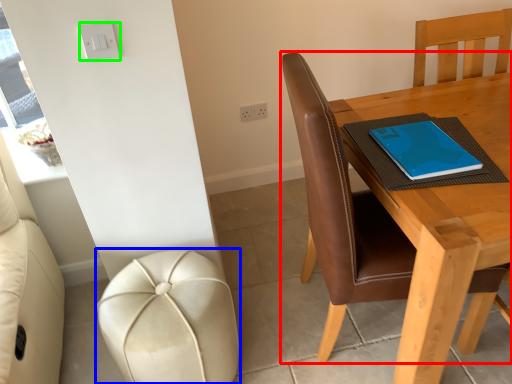
Question: Which object is positioned farthest from chair (highlighted by a red box)? Select from stool (highlighted by a blue box) and light switch (highlighted by a green box).

Choices:
 (A) stool
 (B) light switch

Answer: (B)